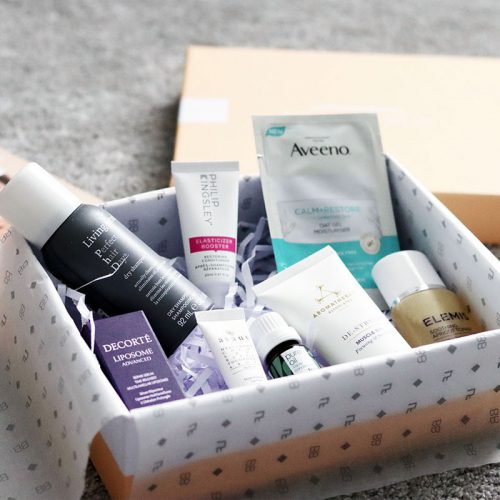
Where is `white tube of aromatherapy cream`? This screenshot has width=500, height=500. white tube of aromatherapy cream is located at coordinates (343, 310).